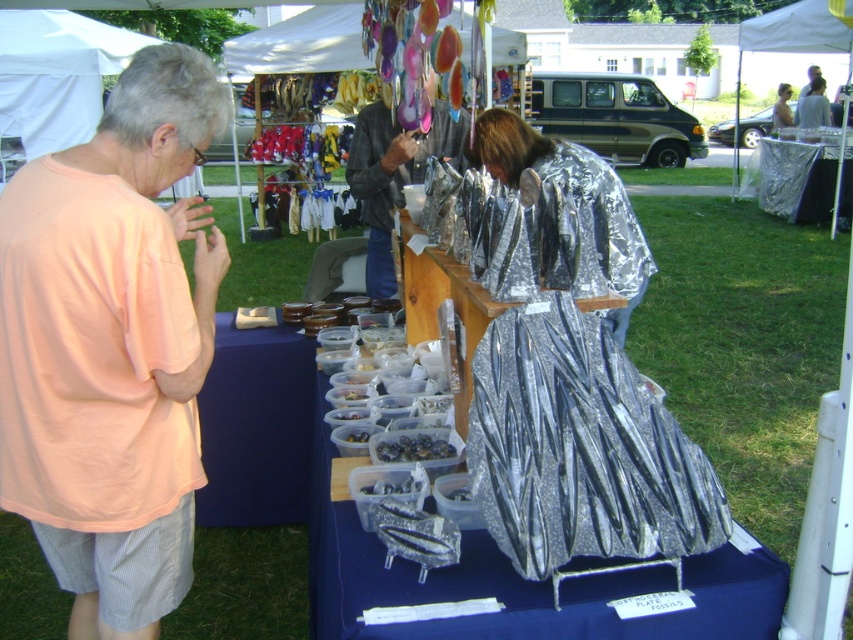
You are a customer at the market and want to approach the person in the metallic silver dress at center. Which direction should you move from the pink cotton shirt at left to reach them?

To reach the metallic silver dress at center from the pink cotton shirt at left, move to the right since the metallic silver dress at center is to the right of the pink cotton shirt at left.

You are a customer at the market and want to buy a souvenir. You notice two items of clothing displayed on the table. Which one is closer to you, the pink cotton shirt at left or the shiny metallic jacket at center?

The pink cotton shirt at left is closer to you because it is positioned under the shiny metallic jacket at center, meaning it is in front and therefore nearer.

You are a customer at the market and want to compare the height of the pink cotton shirt at left and the metallic silver plate at center. Which one is taller?

The pink cotton shirt at left is taller than the metallic silver plate at center.